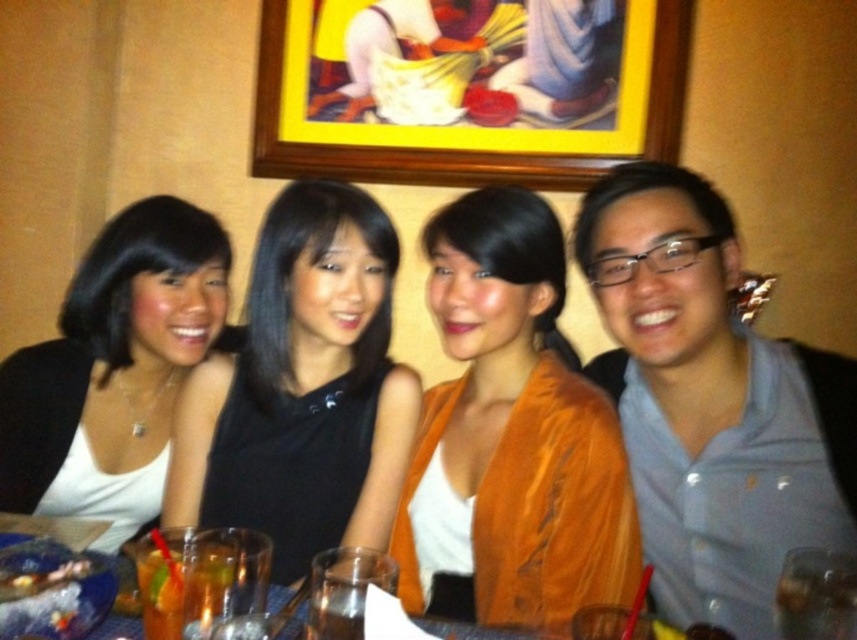
Question: Does orange velvet jacket at center have a larger size compared to white matte tank top at left?

Choices:
 (A) no
 (B) yes

Answer: (B)

Question: Is the position of yellow wood picture frame at upper center more distant than that of translucent glass drink at lower left?

Choices:
 (A) yes
 (B) no

Answer: (A)

Question: Which point is farther to the camera?

Choices:
 (A) white matte tank top at left
 (B) yellow wood picture frame at upper center
 (C) translucent glass drink at lower left

Answer: (B)

Question: Which of these objects is positioned closest to the white matte tank top at left?

Choices:
 (A) yellow wood picture frame at upper center
 (B) translucent glass drink at lower left

Answer: (B)

Question: Among these objects, which one is farthest from the camera?

Choices:
 (A) translucent glass drink at lower left
 (B) white matte tank top at left

Answer: (B)

Question: Is yellow wood picture frame at upper center to the right of orange velvet jacket at center from the viewer's perspective?

Choices:
 (A) yes
 (B) no

Answer: (B)